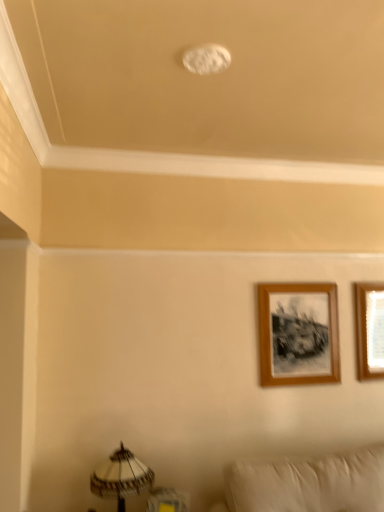
Question: Is wooden picture frame at upper right, the first picture frame when ordered from right to left, thinner than white textured lampshade at lower left?

Choices:
 (A) no
 (B) yes

Answer: (B)

Question: Is wooden picture frame at upper right, the first picture frame when ordered from right to left, bigger than white textured lampshade at lower left?

Choices:
 (A) yes
 (B) no

Answer: (B)

Question: Is wooden picture frame at upper right, which is the second picture frame from left to right, beside white textured lampshade at lower left?

Choices:
 (A) no
 (B) yes

Answer: (A)

Question: Is white textured lampshade at lower left surrounded by wooden picture frame at upper right, the first picture frame when ordered from right to left?

Choices:
 (A) no
 (B) yes

Answer: (A)

Question: Can you confirm if wooden picture frame at upper right, which is the second picture frame from left to right, is wider than white textured lampshade at lower left?

Choices:
 (A) no
 (B) yes

Answer: (A)

Question: Looking at their shapes, would you say wooden picture frame at upper right, which is the second picture frame from left to right, is wider or thinner than wooden frame at upper right, positioned as the 2th picture frame in right-to-left order?

Choices:
 (A) wide
 (B) thin

Answer: (A)

Question: In the image, is wooden picture frame at upper right, which is the second picture frame from left to right, positioned in front of or behind wooden frame at upper right, positioned as the 2th picture frame in right-to-left order?

Choices:
 (A) front
 (B) behind

Answer: (B)

Question: Do you think wooden picture frame at upper right, which is the second picture frame from left to right, is within wooden frame at upper right, which is counted as the 1th picture frame, starting from the left, or outside of it?

Choices:
 (A) outside
 (B) inside

Answer: (A)

Question: Visually, is wooden picture frame at upper right, which is the second picture frame from left to right, positioned to the left or to the right of wooden frame at upper right, positioned as the 2th picture frame in right-to-left order?

Choices:
 (A) right
 (B) left

Answer: (A)

Question: Is wooden frame at upper right, positioned as the 2th picture frame in right-to-left order, to the left or to the right of white textured lampshade at lower left in the image?

Choices:
 (A) left
 (B) right

Answer: (B)

Question: In terms of width, does wooden frame at upper right, positioned as the 2th picture frame in right-to-left order, look wider or thinner when compared to white textured lampshade at lower left?

Choices:
 (A) thin
 (B) wide

Answer: (A)

Question: Is point (317, 350) closer or farther from the camera than point (120, 458)?

Choices:
 (A) farther
 (B) closer

Answer: (A)

Question: Is wooden frame at upper right, positioned as the 2th picture frame in right-to-left order, in front of or behind white textured lampshade at lower left in the image?

Choices:
 (A) front
 (B) behind

Answer: (B)

Question: Considering their positions, is wooden frame at upper right, positioned as the 2th picture frame in right-to-left order, located in front of or behind wooden picture frame at upper right, which is the second picture frame from left to right?

Choices:
 (A) behind
 (B) front

Answer: (B)

Question: Do you think wooden frame at upper right, which is counted as the 1th picture frame, starting from the left, is within wooden picture frame at upper right, which is the second picture frame from left to right, or outside of it?

Choices:
 (A) outside
 (B) inside

Answer: (A)